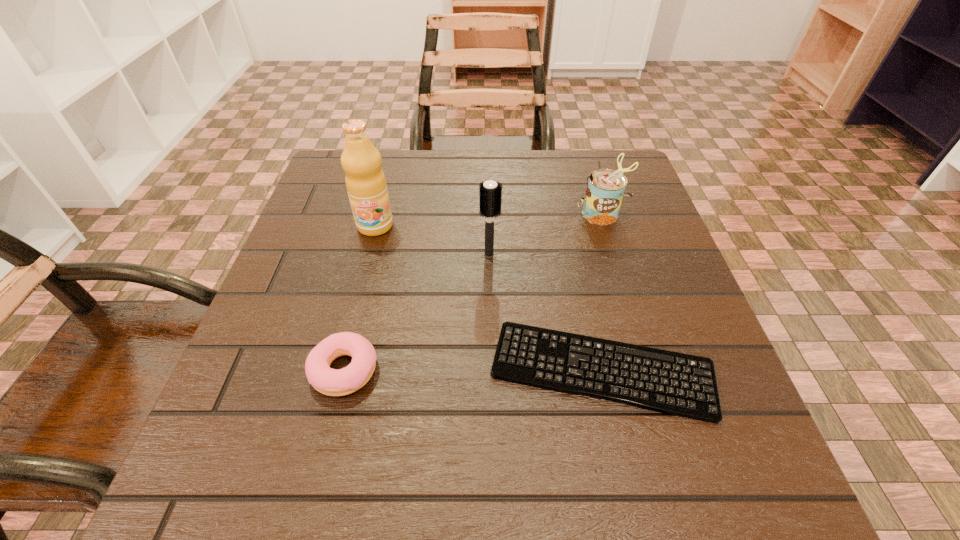
You are a GUI agent. You are given a task and a screenshot of the screen. Output one action in this format:
    pyautogui.click(x=<x>, y=<y>)
    Task: Click on the vacant area that satisfies the following two spatial constraints: 1. on the front label of the second shortest object; 2. on the right side of the fruit juice
    
    Given the screenshot: What is the action you would take?
    pyautogui.click(x=338, y=370)

You are a GUI agent. You are given a task and a screenshot of the screen. Output one action in this format:
    pyautogui.click(x=<x>, y=<y>)
    Task: Click on the vacant region that satisfies the following two spatial constraints: 1. on the back side of the shortest object; 2. on the right side of the third shortest object
    
    Given the screenshot: What is the action you would take?
    pyautogui.click(x=567, y=213)